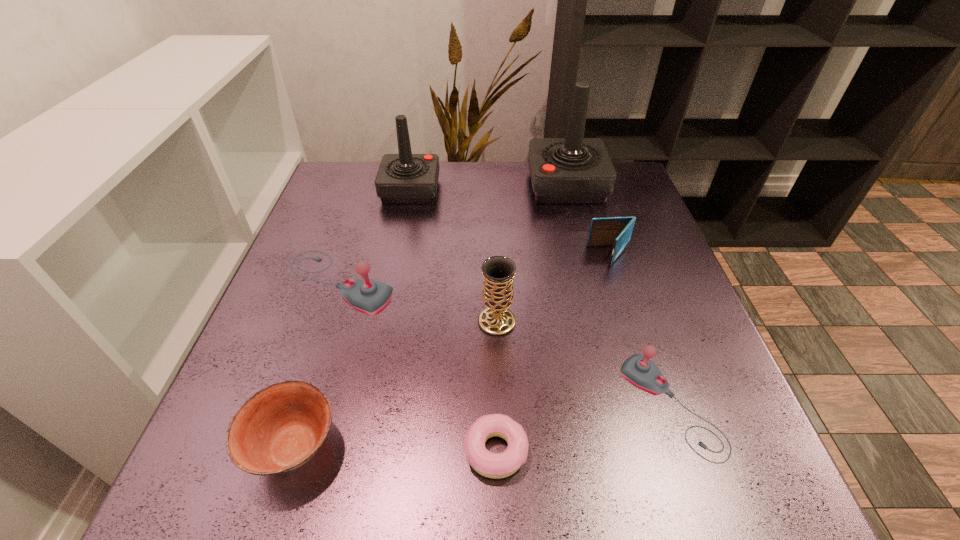
Find the location of a particular element. Image resolution: width=960 pixels, height=540 pixels. free space located 0.230m on the exterior surface of the blue wallet is located at coordinates (489, 256).

You are a GUI agent. You are given a task and a screenshot of the screen. Output one action in this format:
    pyautogui.click(x=<x>, y=<y>)
    Task: Click on the free space located on the exterior surface of the blue wallet
    Image resolution: width=960 pixels, height=540 pixels.
    Given the screenshot: What is the action you would take?
    pyautogui.click(x=427, y=256)

Where is `free spot located 0.110m on the left of the smaller gray joystick`? The width and height of the screenshot is (960, 540). free spot located 0.110m on the left of the smaller gray joystick is located at coordinates (561, 406).

Locate an element on the screen. free space located 0.070m on the left of the bowl is located at coordinates tap(204, 447).

What are the coordinates of `free location located on the right of the pink doughnut` in the screenshot? It's located at (631, 451).

Where is `joystick present at the near edge`? Image resolution: width=960 pixels, height=540 pixels. joystick present at the near edge is located at coordinates (638, 370).

This screenshot has width=960, height=540. Find the location of `bowl at the near edge`. bowl at the near edge is located at coordinates [279, 428].

I want to click on doughnut that is at the near edge, so click(493, 465).

Where is `bowl situated at the left edge`? bowl situated at the left edge is located at coordinates (279, 428).

Where is `wallet present at the right edge`? The width and height of the screenshot is (960, 540). wallet present at the right edge is located at coordinates (612, 231).